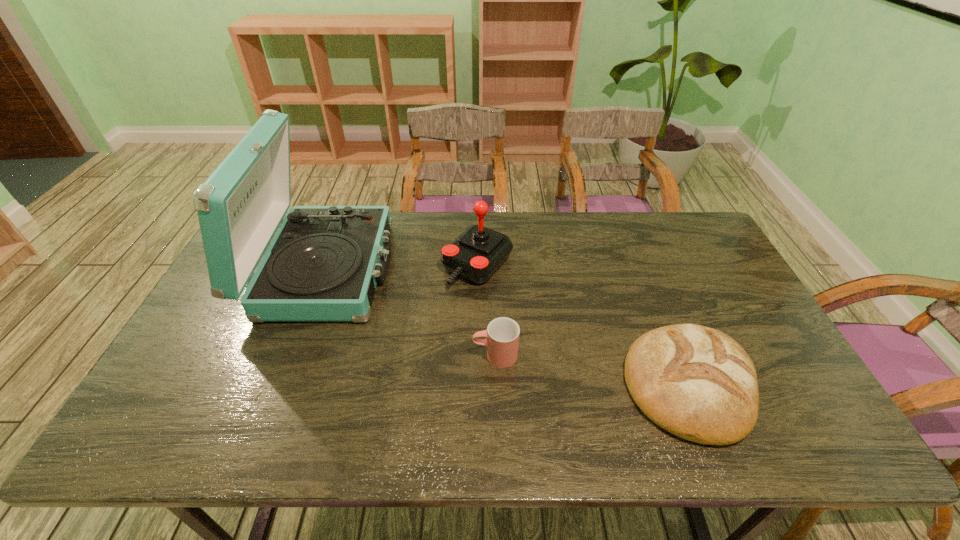
You are a GUI agent. You are given a task and a screenshot of the screen. Output one action in this format:
    pyautogui.click(x=<x>, y=<y>)
    Task: Click on the free space that satisfies the following two spatial constraints: 1. on the back side of the rightmost object; 2. on the face side of the record player
    
    Given the screenshot: What is the action you would take?
    pyautogui.click(x=643, y=269)